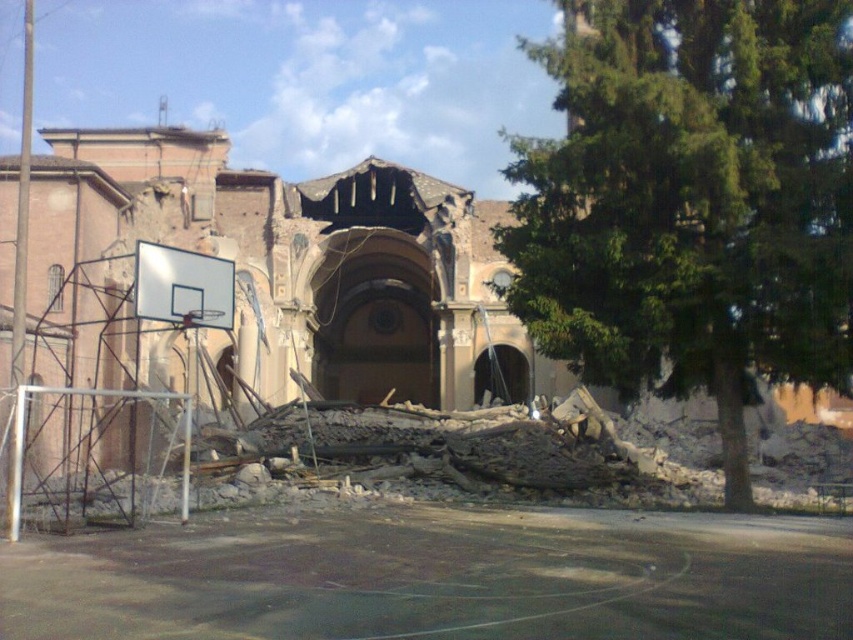
Question: Which point is farther to the camera?

Choices:
 (A) smooth asphalt basketball court at lower center
 (B) green leafy tree at center

Answer: (B)

Question: Can you confirm if green leafy tree at center is positioned above smooth asphalt basketball court at lower center?

Choices:
 (A) yes
 (B) no

Answer: (A)

Question: Among these objects, which one is farthest from the camera?

Choices:
 (A) green leafy tree at center
 (B) smooth asphalt basketball court at lower center

Answer: (A)

Question: Which object appears closest to the camera in this image?

Choices:
 (A) smooth asphalt basketball court at lower center
 (B) green leafy tree at center

Answer: (A)

Question: Observing the image, what is the correct spatial positioning of green leafy tree at center in reference to smooth asphalt basketball court at lower center?

Choices:
 (A) below
 (B) above

Answer: (B)

Question: Is green leafy tree at center above smooth asphalt basketball court at lower center?

Choices:
 (A) yes
 (B) no

Answer: (A)